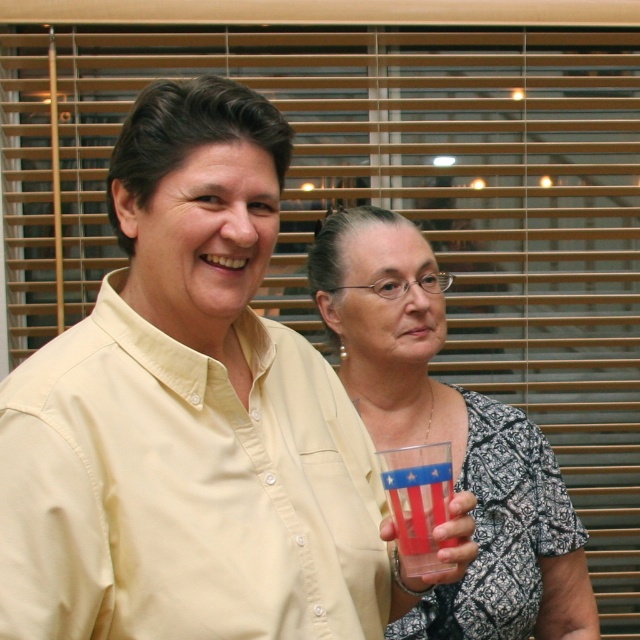
You are a bartender preparing drinks for a party. You have two cups in front of you, the translucent plastic cup at center and the translucent plastic cup at lower center. Which cup can hold more liquid without spilling?

The translucent plastic cup at center can hold more liquid without spilling because it is larger in size than the translucent plastic cup at lower center.

In the scene shown: You are arranging drinks on a table and need to place a new cup between the translucent plastic cup at center and the translucent plastic cup at lower center. Based on their positions, which cup should you place the new cup closer to?

You should place the new cup closer to the translucent plastic cup at lower center because the translucent plastic cup at center is to the right of it, meaning the lower center cup is on the left side. Since you want to place the new cup between them, positioning it closer to the lower center cup would maintain the spatial arrangement.

You are a delivery person who needs to place a small package on the table where the translucent plastic cup at center is located. The table is rectangular and extends from point A at the bottom left corner to point B at the top right corner. Given that the cup is at point C, which is at coordinates (451, 436), can you determine if the package will fit on the table without overlapping the cup?

The translucent plastic cup at center is located at point C with coordinates (451, 436). Since the table extends from point A to point B, the package can be placed anywhere on the table except at point C to avoid overlapping the cup.